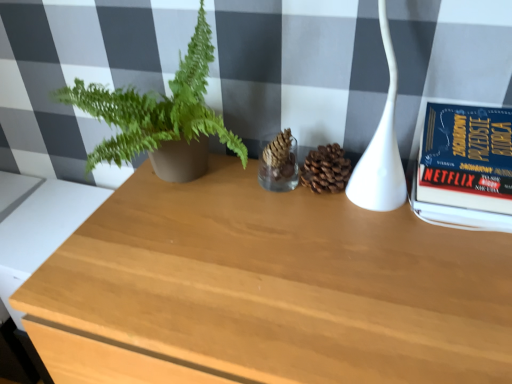
Question: In the image, is white glossy lamp at upper right on the left side or the right side of hardcover book at right?

Choices:
 (A) left
 (B) right

Answer: (A)

Question: From the image's perspective, is white glossy lamp at upper right positioned above or below hardcover book at right?

Choices:
 (A) above
 (B) below

Answer: (A)

Question: Which object is positioned closest to the hardcover book at right?

Choices:
 (A) light wood table at lower left, the second table when ordered from right to left
 (B) green matte plant at left
 (C) wooden table at center, arranged as the 1th table when viewed from the right
 (D) white glossy lamp at upper right

Answer: (D)

Question: Estimate the real-world distances between objects in this image. Which object is farther from the hardcover book at right?

Choices:
 (A) white glossy lamp at upper right
 (B) wooden table at center, arranged as the 1th table when viewed from the right
 (C) light wood table at lower left, acting as the 1th table starting from the left
 (D) green matte plant at left

Answer: (C)